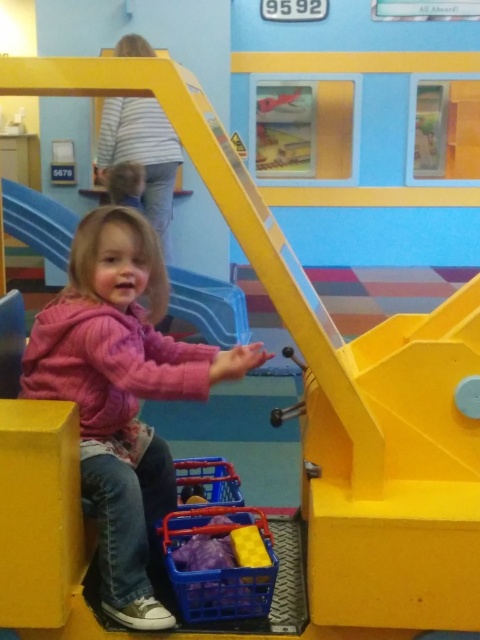
You are a parent trying to locate your child in a play area. You see the yellow plastic slide at center and the blonde hair at upper center. Which object is closer to you?

The yellow plastic slide at center is closer to you because it is further to the viewer than the blonde hair at upper center, meaning it appears nearer in the image.